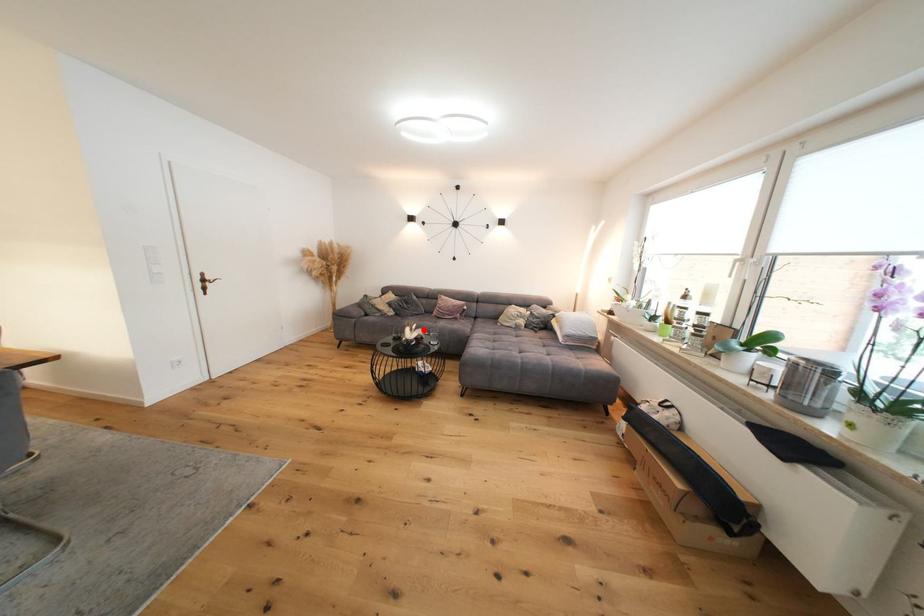
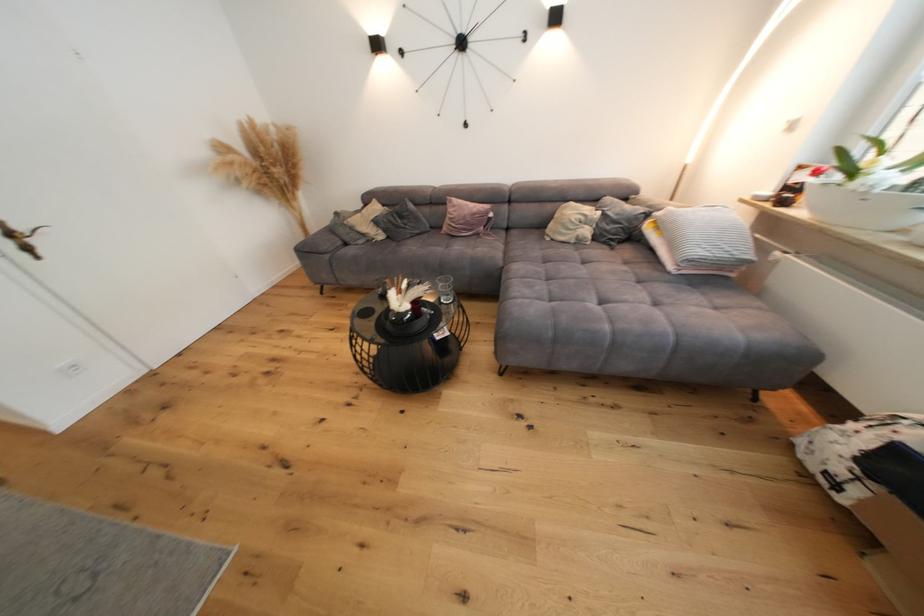
Question: I am providing you with two images of the same scene from different viewpoints. A red point is shown in image1. For the corresponding object point in image2, is it positioned nearer or farther from the camera?

Choices:
 (A) Nearer
 (B) Farther

Answer: (A)